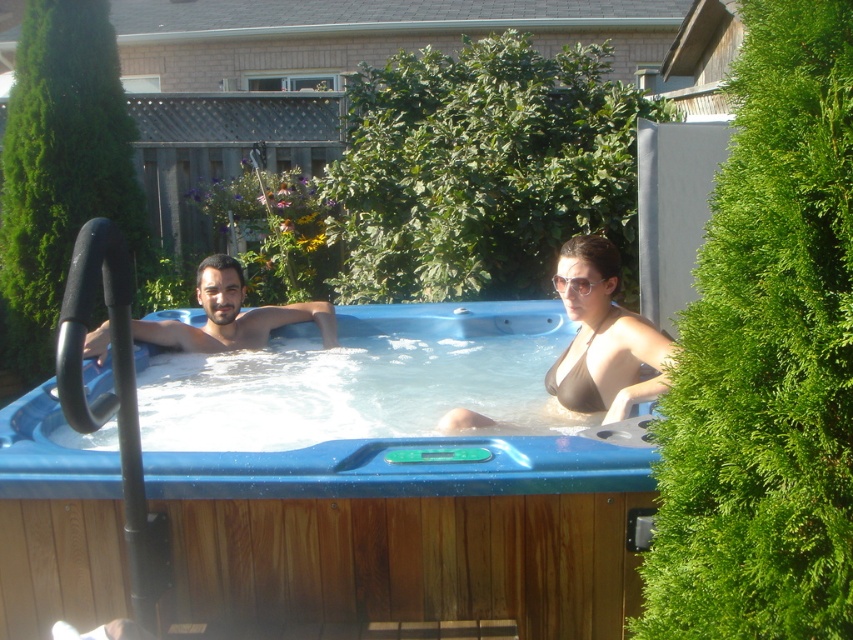
Question: Considering the relative positions of brown bikini top at center and matte black man at left in the image provided, where is brown bikini top at center located with respect to matte black man at left?

Choices:
 (A) above
 (B) below

Answer: (B)

Question: Which point is farther to the camera?

Choices:
 (A) blue wood hot tub at center
 (B) matte black man at left
 (C) brown bikini top at center

Answer: (B)

Question: Can you confirm if blue wood hot tub at center is thinner than matte black man at left?

Choices:
 (A) no
 (B) yes

Answer: (A)

Question: Which of the following is the farthest from the observer?

Choices:
 (A) brown bikini top at center
 (B) blue wood hot tub at center
 (C) matte black man at left

Answer: (C)

Question: Estimate the real-world distances between objects in this image. Which object is closer to the blue wood hot tub at center?

Choices:
 (A) brown bikini top at center
 (B) matte black man at left

Answer: (A)

Question: Is blue wood hot tub at center bigger than brown bikini top at center?

Choices:
 (A) yes
 (B) no

Answer: (A)